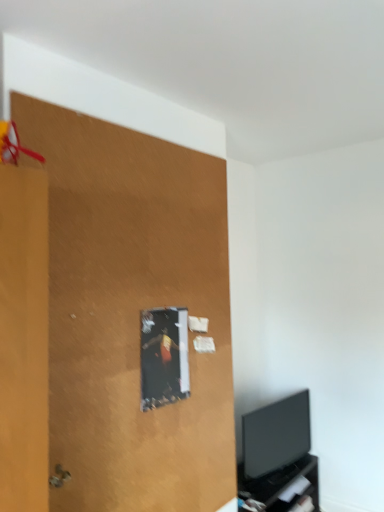
Question: From the image's perspective, is matte brown plywood at upper left under black matte tv cabinet at lower right?

Choices:
 (A) yes
 (B) no

Answer: (B)

Question: Is matte brown plywood at upper left aimed at black matte tv cabinet at lower right?

Choices:
 (A) yes
 (B) no

Answer: (B)

Question: From a real-world perspective, is matte brown plywood at upper left physically below black matte tv cabinet at lower right?

Choices:
 (A) yes
 (B) no

Answer: (B)

Question: Is black matte tv cabinet at lower right surrounded by matte brown plywood at upper left?

Choices:
 (A) yes
 (B) no

Answer: (B)

Question: Can you confirm if matte brown plywood at upper left is smaller than black matte tv cabinet at lower right?

Choices:
 (A) no
 (B) yes

Answer: (B)

Question: From the image's perspective, is matte brown plywood at upper left over black matte tv cabinet at lower right?

Choices:
 (A) yes
 (B) no

Answer: (A)

Question: Is black matte tv cabinet at lower right oriented away from black glossy tv at lower right?

Choices:
 (A) yes
 (B) no

Answer: (B)

Question: Considering the relative positions of black matte tv cabinet at lower right and black glossy tv at lower right in the image provided, is black matte tv cabinet at lower right to the left of black glossy tv at lower right from the viewer's perspective?

Choices:
 (A) no
 (B) yes

Answer: (B)

Question: Can you confirm if black matte tv cabinet at lower right is smaller than black glossy tv at lower right?

Choices:
 (A) yes
 (B) no

Answer: (B)

Question: Is black matte tv cabinet at lower right far from black glossy tv at lower right?

Choices:
 (A) yes
 (B) no

Answer: (B)

Question: From a real-world perspective, is black matte tv cabinet at lower right positioned over black glossy tv at lower right based on gravity?

Choices:
 (A) no
 (B) yes

Answer: (A)

Question: Is black matte tv cabinet at lower right located outside black glossy tv at lower right?

Choices:
 (A) yes
 (B) no

Answer: (A)

Question: From the image's perspective, is black glossy tv at lower right over matte brown plywood at upper left?

Choices:
 (A) yes
 (B) no

Answer: (B)